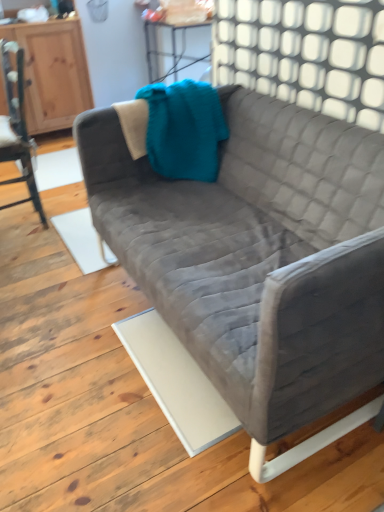
Question: Does velvet gray couch at center turn towards wooden chair at left?

Choices:
 (A) no
 (B) yes

Answer: (A)

Question: Considering the relative sizes of velvet gray couch at center and wooden chair at left in the image provided, is velvet gray couch at center taller than wooden chair at left?

Choices:
 (A) yes
 (B) no

Answer: (B)

Question: From a real-world perspective, is velvet gray couch at center located higher than wooden chair at left?

Choices:
 (A) no
 (B) yes

Answer: (A)

Question: From a real-world perspective, is velvet gray couch at center located beneath wooden chair at left?

Choices:
 (A) yes
 (B) no

Answer: (A)

Question: From the image's perspective, is velvet gray couch at center located beneath wooden chair at left?

Choices:
 (A) yes
 (B) no

Answer: (A)

Question: Is white textured wall at upper center taller or shorter than wooden dresser at left?

Choices:
 (A) tall
 (B) short

Answer: (B)

Question: In terms of size, does white textured wall at upper center appear bigger or smaller than wooden dresser at left?

Choices:
 (A) big
 (B) small

Answer: (B)

Question: Would you say white textured wall at upper center is inside or outside wooden dresser at left?

Choices:
 (A) outside
 (B) inside

Answer: (A)

Question: Visually, is white textured wall at upper center positioned to the left or to the right of wooden dresser at left?

Choices:
 (A) right
 (B) left

Answer: (A)

Question: From a real-world perspective, is velvet gray couch at center positioned above or below wooden chair at left?

Choices:
 (A) above
 (B) below

Answer: (B)

Question: In terms of height, does velvet gray couch at center look taller or shorter compared to wooden chair at left?

Choices:
 (A) tall
 (B) short

Answer: (B)

Question: Looking at the image, does velvet gray couch at center seem bigger or smaller compared to wooden chair at left?

Choices:
 (A) big
 (B) small

Answer: (A)

Question: In the image, is velvet gray couch at center positioned in front of or behind wooden chair at left?

Choices:
 (A) behind
 (B) front

Answer: (B)

Question: Considering the positions of wooden dresser at left and white textured wall at upper center in the image, is wooden dresser at left taller or shorter than white textured wall at upper center?

Choices:
 (A) tall
 (B) short

Answer: (A)

Question: Considering the positions of wooden dresser at left and white textured wall at upper center in the image, is wooden dresser at left wider or thinner than white textured wall at upper center?

Choices:
 (A) wide
 (B) thin

Answer: (A)